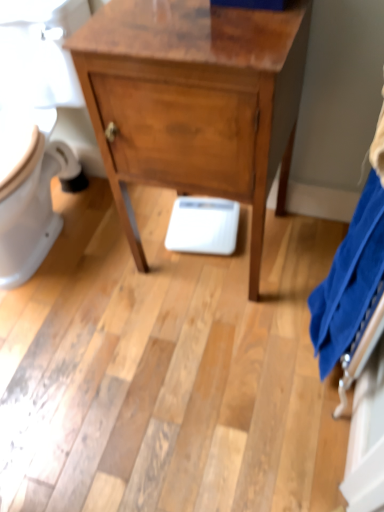
What do you see at coordinates (193, 100) in the screenshot? I see `wooden chest of drawers at center` at bounding box center [193, 100].

Find the location of a particular element. This screenshot has width=384, height=512. wooden chest of drawers at center is located at coordinates (193, 100).

This screenshot has width=384, height=512. Identify the location of wooden chest of drawers at center. (193, 100).